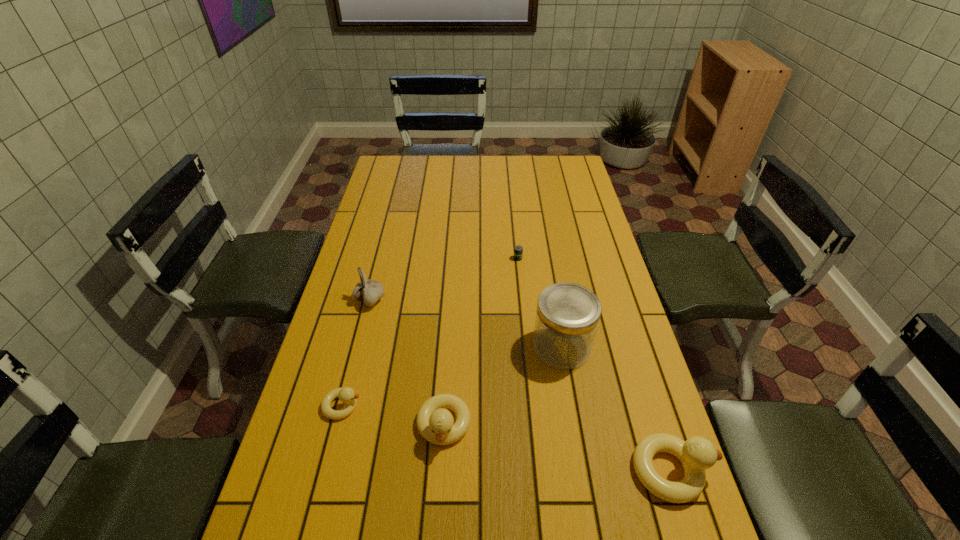
If equal spacing is desired by inserting an extra duckling among them, please point out a free spot for this new duckling. Please provide its 2D coordinates. Your answer should be formatted as a tuple, i.e. [(x, y)], where the tuple contains the x and y coordinates of a point satisfying the conditions above.

[(553, 447)]